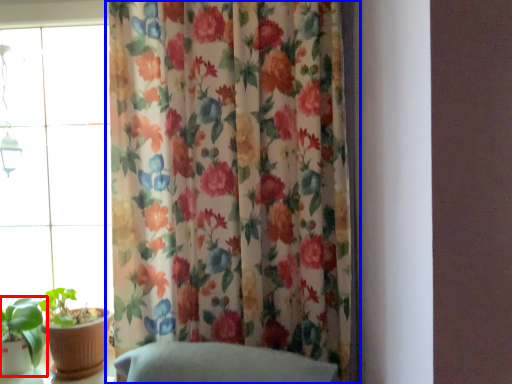
Question: Among these objects, which one is nearest to the camera, houseplant (highlighted by a red box) or curtain (highlighted by a blue box)?

Choices:
 (A) houseplant
 (B) curtain

Answer: (B)